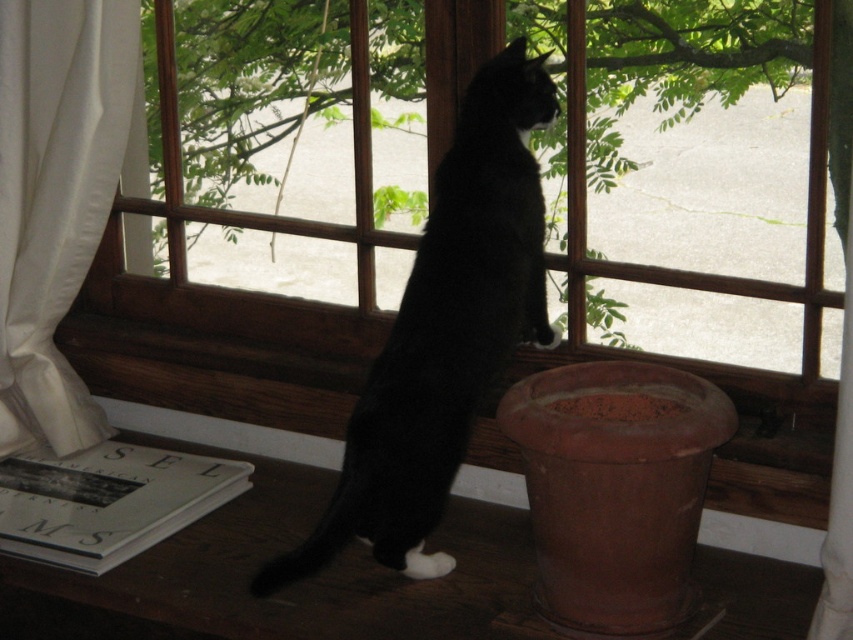
You are a small toy mouse placed exactly at the position of point (282, 474). You want to roll towards point (466, 317). Considering the spatial relationship between these two points, will you be moving closer to or further away from the viewer?

Since point (282, 474) is further to the viewer than point (466, 317), rolling towards point (466, 317) means you will be moving further away from the viewer.

You are standing in front of the window where the black cat is perched. You notice two points marked on the windowsill. One is at coordinate point [450,109] and the other at point [315,460]. Which point is closer to you?

Point [450,109] is closer to the camera than point [315,460], so the point at coordinate [450,109] is closer to you.